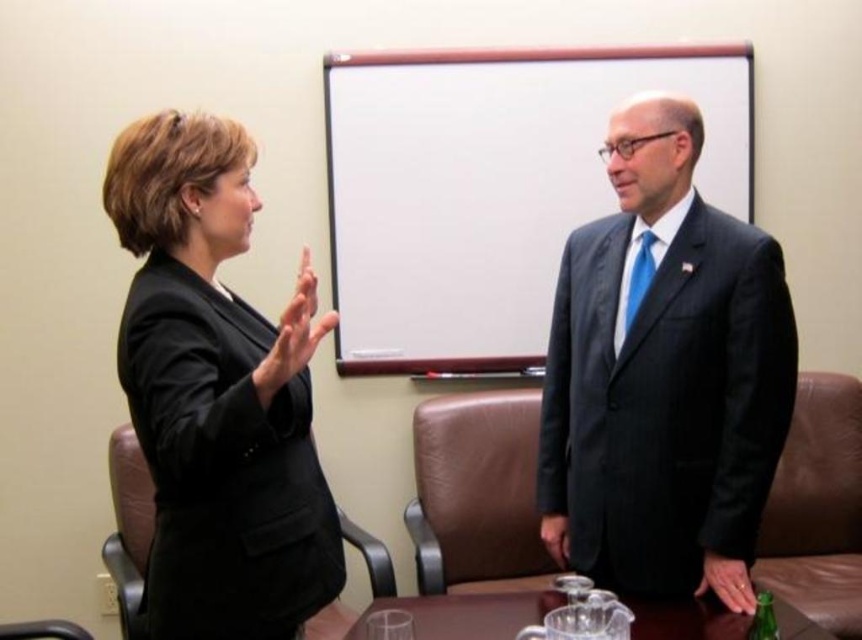
Does dark blue suit at right have a lesser height compared to clear glass table at center?

No.

Is dark blue suit at right positioned before clear glass table at center?

No, it is not.

Is point (573, 268) positioned after point (428, 627)?

Yes, it is behind point (428, 627).

I want to click on dark blue suit at right, so click(x=663, y=376).

Is point (251, 157) positioned before point (791, 634)?

Yes, it is in front of point (791, 634).

Does black matte suit at left appear under clear glass table at center?

No, black matte suit at left is not below clear glass table at center.

Describe the element at coordinates (217, 394) in the screenshot. I see `black matte suit at left` at that location.

Locate an element on the screen. This screenshot has width=862, height=640. black matte suit at left is located at coordinates (217, 394).

At what (x,y) coordinates should I click in order to perform the action: click on white matte projection screen at upper center. Please return your answer as a coordinate pair (x, y). Looking at the image, I should click on (489, 188).

Measure the distance between point [335,61] and camera.

Point [335,61] is 8.52 feet from camera.

You are a GUI agent. You are given a task and a screenshot of the screen. Output one action in this format:
    pyautogui.click(x=<x>, y=<y>)
    Task: Click on the white matte projection screen at upper center
    The width and height of the screenshot is (862, 640).
    Given the screenshot: What is the action you would take?
    pyautogui.click(x=489, y=188)